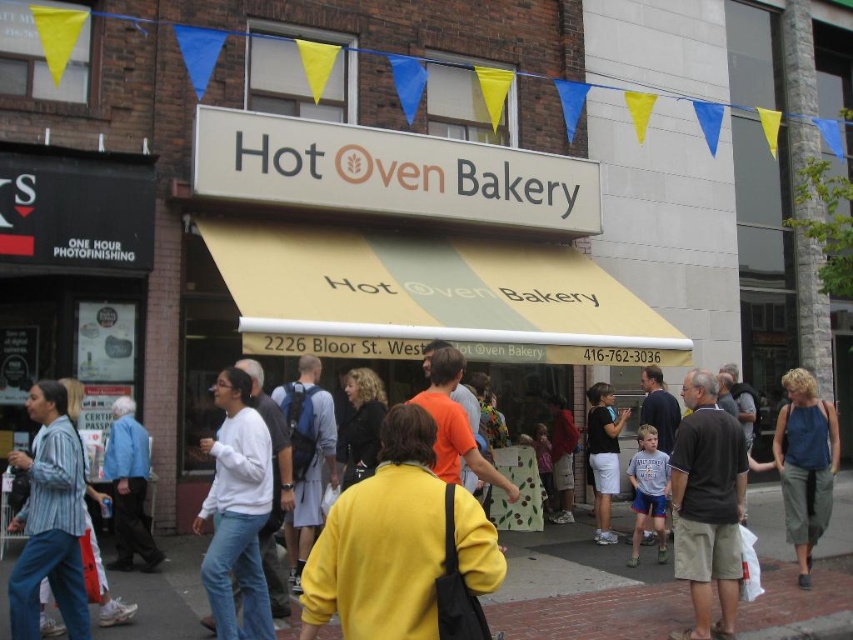
You are a customer waiting in line at Hot Oven Bakery. You notice a matte blue backpack at center and a matte orange shirt at center. Which item is closer to the left side of the bakery entrance?

The matte blue backpack at center is closer to the left side of the bakery entrance because it is positioned to the left of the matte orange shirt at center.

You are a customer standing in front of Hot Oven Bakery and notice two items at the center of the scene. Which item is smaller in size between the matte blue backpack at center and the matte orange shirt at center?

The matte blue backpack at center is smaller in size compared to the matte orange shirt at center.

You are a photographer setting up a backdrop for a photoshoot. You have two options for the main subject clothing items displayed in the center of the frame. The white matte sweater at center and the matte orange shirt at center. Based on the scene description, which clothing item would require a wider backdrop to accommodate its width?

The white matte sweater at center might be wider than matte orange shirt at center, so it would require a wider backdrop to accommodate its width.